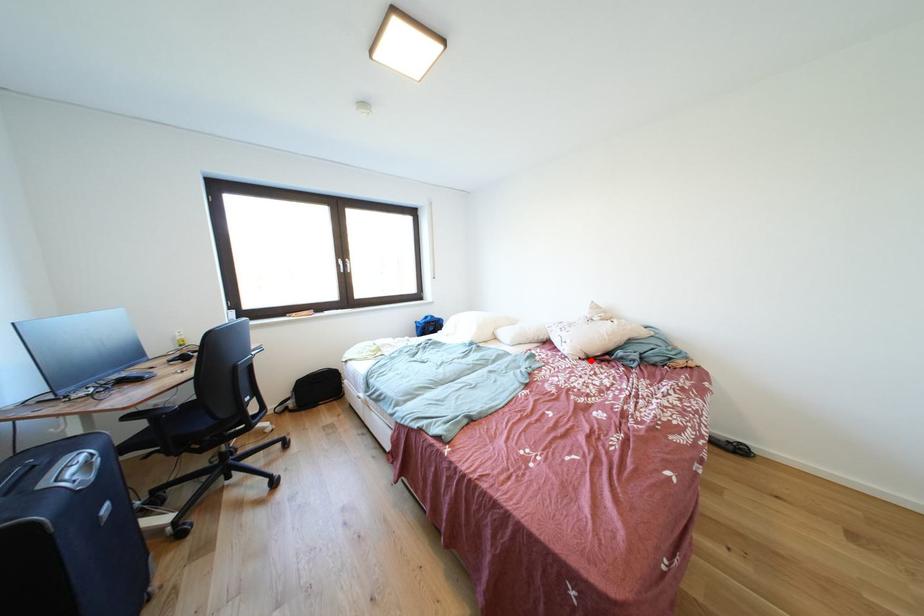
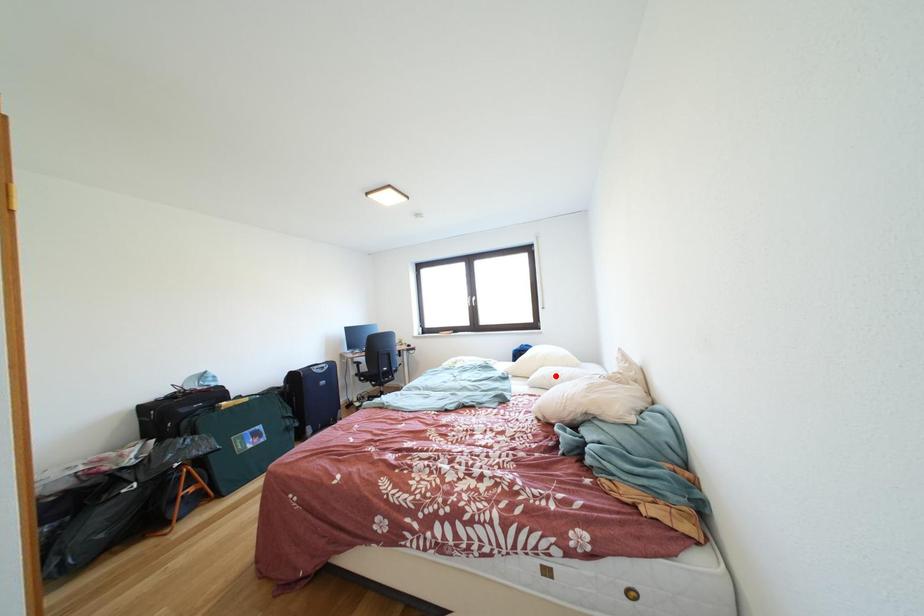
I am providing you with two images of the same scene from different viewpoints. A red point is marked on the first image and another point is marked on the second image. Is the red point in image1 aligned with the point shown in image2?

No